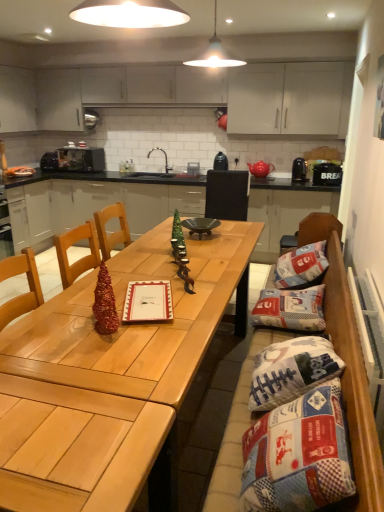
Question: From the image's perspective, is black matte sink at center beneath green matte christmas tree at center, the 2th christmas tree when ordered from front to back?

Choices:
 (A) no
 (B) yes

Answer: (A)

Question: Can you confirm if black matte sink at center is thinner than green matte christmas tree at center, which ranks as the second christmas tree in left-to-right order?

Choices:
 (A) yes
 (B) no

Answer: (B)

Question: Considering the relative sizes of black matte sink at center and green matte christmas tree at center, which is the first christmas tree from back to front, in the image provided, is black matte sink at center shorter than green matte christmas tree at center, which is the first christmas tree from back to front,?

Choices:
 (A) no
 (B) yes

Answer: (A)

Question: Can you confirm if black matte sink at center is bigger than green matte christmas tree at center, which is counted as the 2th christmas tree, starting from the bottom?

Choices:
 (A) yes
 (B) no

Answer: (A)

Question: From a real-world perspective, is black matte sink at center positioned over green matte christmas tree at center, which ranks as the second christmas tree in left-to-right order, based on gravity?

Choices:
 (A) yes
 (B) no

Answer: (A)

Question: From the image's perspective, does black matte sink at center appear higher than green matte christmas tree at center, the 2th christmas tree when ordered from front to back?

Choices:
 (A) no
 (B) yes

Answer: (B)

Question: Does shiny wood table at center have a lesser width compared to patchwork fabric bean bag chair at center?

Choices:
 (A) yes
 (B) no

Answer: (B)

Question: Considering the relative sizes of shiny wood table at center and patchwork fabric bean bag chair at center in the image provided, is shiny wood table at center taller than patchwork fabric bean bag chair at center?

Choices:
 (A) yes
 (B) no

Answer: (B)

Question: Can you see shiny wood table at center touching patchwork fabric bean bag chair at center?

Choices:
 (A) yes
 (B) no

Answer: (B)

Question: Considering the relative sizes of shiny wood table at center and patchwork fabric bean bag chair at center in the image provided, is shiny wood table at center shorter than patchwork fabric bean bag chair at center?

Choices:
 (A) no
 (B) yes

Answer: (B)

Question: From the image's perspective, would you say shiny wood table at center is positioned over patchwork fabric bean bag chair at center?

Choices:
 (A) yes
 (B) no

Answer: (A)

Question: Are shiny wood table at center and patchwork fabric bean bag chair at center located far from each other?

Choices:
 (A) no
 (B) yes

Answer: (A)

Question: Is shiny metallic christmas tree at center, acting as the second christmas tree starting from the back, to the right of metallic microwave at upper left, the fourth appliance in the right-to-left sequence, from the viewer's perspective?

Choices:
 (A) yes
 (B) no

Answer: (A)